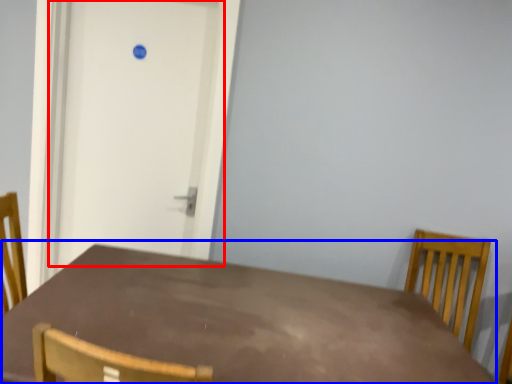
Question: Among these objects, which one is nearest to the camera, door (highlighted by a red box) or table (highlighted by a blue box)?

Choices:
 (A) door
 (B) table

Answer: (B)